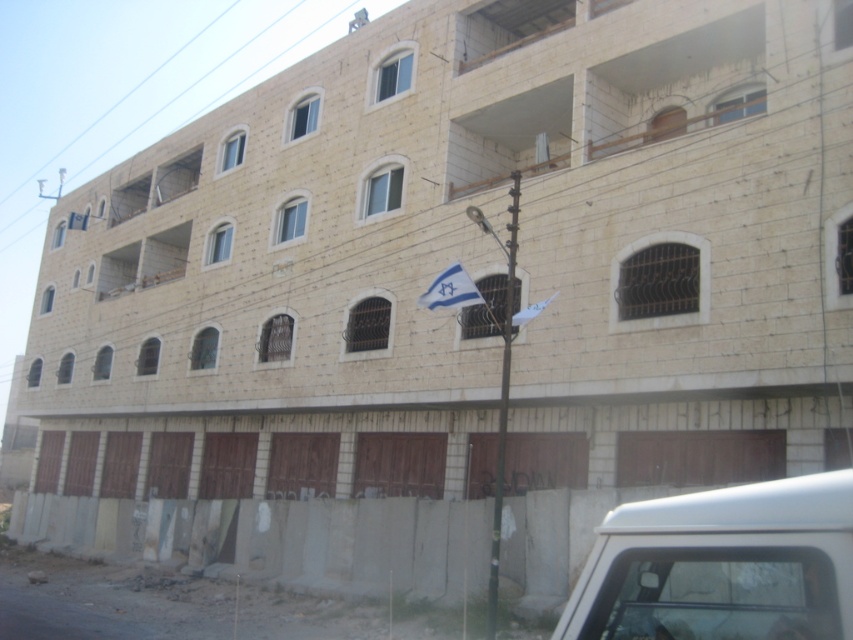
Question: Does white matte van at lower right appear on the left side of black metal pole at center?

Choices:
 (A) yes
 (B) no

Answer: (A)

Question: Does black metal pole at center appear over blue fabric flag at center?

Choices:
 (A) no
 (B) yes

Answer: (A)

Question: Considering the real-world distances, which object is farthest from the white fabric flag at center?

Choices:
 (A) blue fabric flag at center
 (B) black metal pole at center
 (C) white matte van at lower right

Answer: (C)

Question: Among these points, which one is nearest to the camera?

Choices:
 (A) (450, 305)
 (B) (840, 632)

Answer: (B)

Question: Considering the real-world distances, which object is closest to the white matte van at lower right?

Choices:
 (A) black metal pole at center
 (B) blue fabric flag at center
 (C) white fabric flag at center

Answer: (B)

Question: Can you confirm if white matte van at lower right is wider than white fabric flag at center?

Choices:
 (A) yes
 (B) no

Answer: (B)